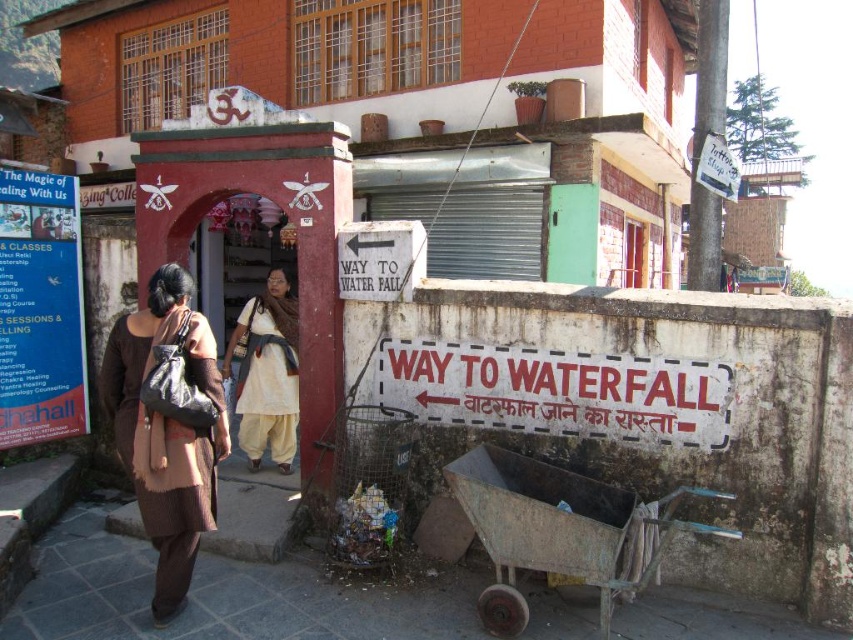
You are a tourist in this town and need to find the waterfall. You see a rusty metal cart at lower center and a blue paper sign at left. Which object should you look at to find the direction to the waterfall?

The blue paper sign at left is the one you should look at to find the direction to the waterfall, as the rusty metal cart at lower center is located to its right, meaning the sign is positioned to the left and likely contains the necessary information.

You are a customer looking to buy a dress and see the brown textured dress at left and the rusty metal cart at lower center in the scene. Which item is taller?

The brown textured dress at left is taller than the rusty metal cart at lower center.

You are standing in the street scene and want to take a photo of the brown textured dress at left. You have a camera that has a maximum focus range of 3.5 meters. Will you be able to focus on the dress without moving closer?

The brown textured dress at left and camera are 3.72 meters apart from each other, which exceeds the camera maximum focus range of 3.5 meters. Therefore, you will not be able to focus on the dress without moving closer.